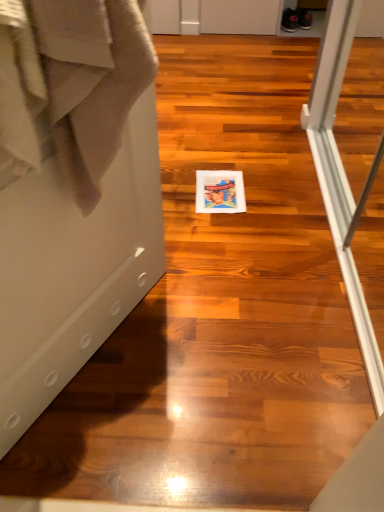
Locate an element on the screen. The width and height of the screenshot is (384, 512). free space in front of matte paper postcard at center is located at coordinates (223, 227).